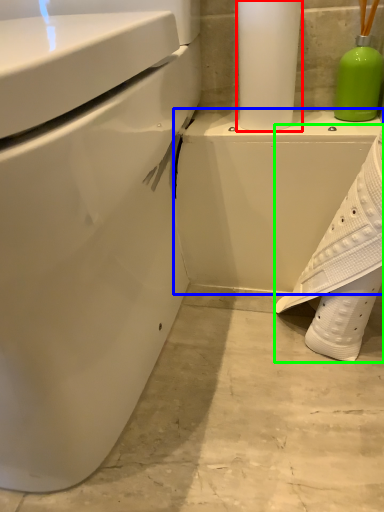
Question: Estimate the real-world distances between objects in this image. Which object is farther from paper towel (highlighted by a red box), porcelain (highlighted by a blue box) or shoe (highlighted by a green box)?

Choices:
 (A) porcelain
 (B) shoe

Answer: (B)